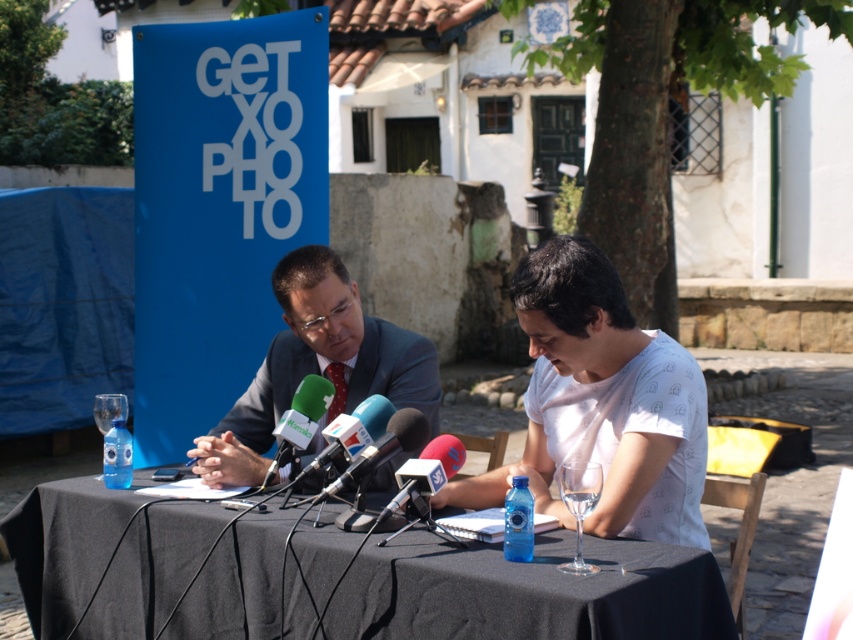
Does black fabric table at center lie behind transparent plastic bottle at table center?

No, black fabric table at center is in front of transparent plastic bottle at table center.

Is black fabric table at center to the left of transparent plastic bottle at table center from the viewer's perspective?

Incorrect, black fabric table at center is not on the left side of transparent plastic bottle at table center.

At what (x,y) coordinates should I click in order to perform the action: click on black fabric table at center. Please return your answer as a coordinate pair (x, y). Looking at the image, I should click on (527, 592).

Does transparent plastic bottle at center appear on the right side of transparent plastic bottle at table center?

Correct, you'll find transparent plastic bottle at center to the right of transparent plastic bottle at table center.

Is transparent plastic bottle at center further to the viewer compared to transparent plastic bottle at table center?

No.

Image resolution: width=853 pixels, height=640 pixels. I want to click on transparent plastic bottle at center, so click(518, 522).

Based on the photo, is green fabric microphone at center positioned at the back of transparent plastic bottle at table center?

No, it is in front of transparent plastic bottle at table center.

Does green fabric microphone at center have a smaller size compared to transparent plastic bottle at table center?

No, green fabric microphone at center is not smaller than transparent plastic bottle at table center.

Between point (274, 465) and point (126, 440), which one is positioned in front?

Point (274, 465) is more forward.

Image resolution: width=853 pixels, height=640 pixels. In order to click on green fabric microphone at center in this screenshot , I will do `click(299, 420)`.